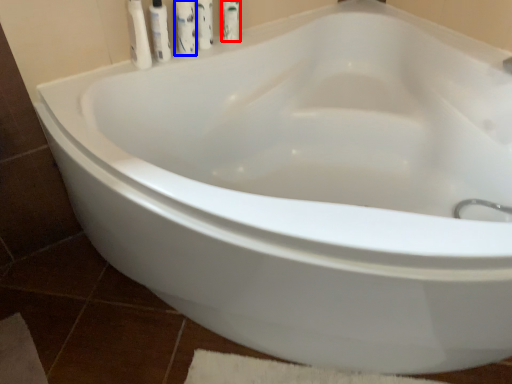
Question: Which point is closer to the camera, mouthwash (highlighted by a red box) or cleaning product (highlighted by a blue box)?

Choices:
 (A) mouthwash
 (B) cleaning product

Answer: (B)